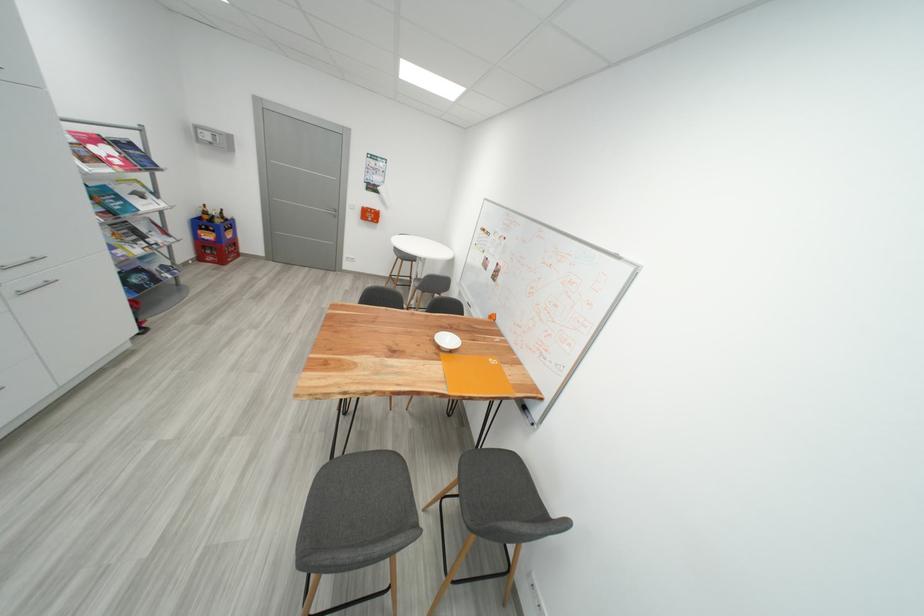
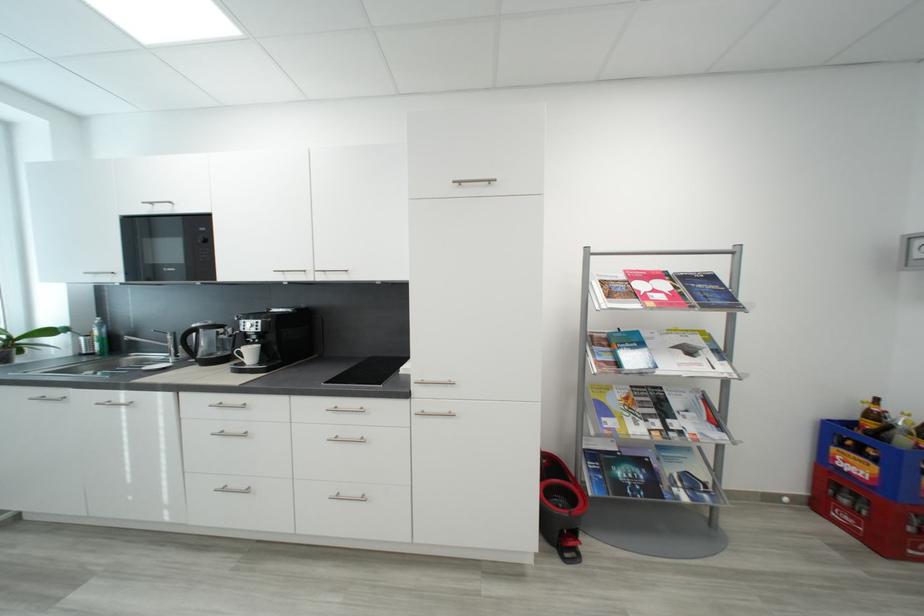
Where in the second image is the point corresponding to (213,215) from the first image?

(881, 418)